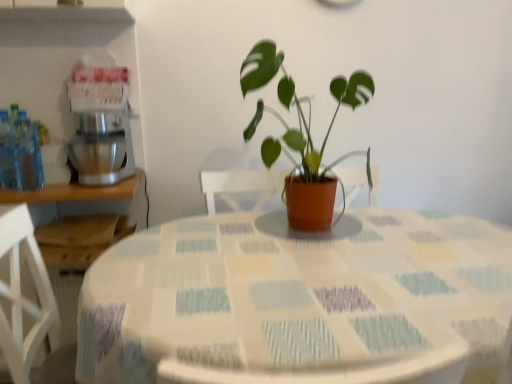
Question: Choose the correct answer: Is textured fabric tablecloth at center inside silver metallic mixer at left or outside it?

Choices:
 (A) outside
 (B) inside

Answer: (A)

Question: In the image, is textured fabric tablecloth at center positioned in front of or behind silver metallic mixer at left?

Choices:
 (A) behind
 (B) front

Answer: (B)

Question: Which object is the farthest from the silver metallic mixer at left?

Choices:
 (A) textured fabric tablecloth at center
 (B) matte terracotta pot at center

Answer: (A)

Question: Based on their relative distances, which object is farther from the matte terracotta pot at center?

Choices:
 (A) textured fabric tablecloth at center
 (B) silver metallic mixer at left

Answer: (B)